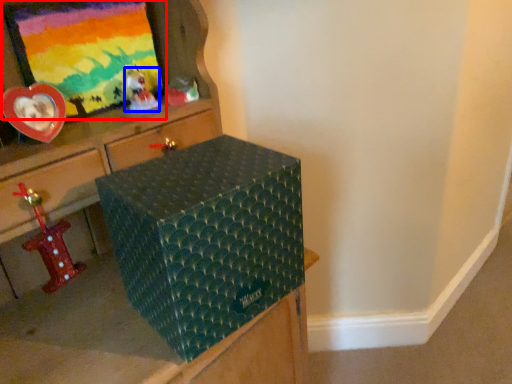
Question: Which object appears closest to the camera in this image, picture frame (highlighted by a red box) or toy (highlighted by a blue box)?

Choices:
 (A) picture frame
 (B) toy

Answer: (A)